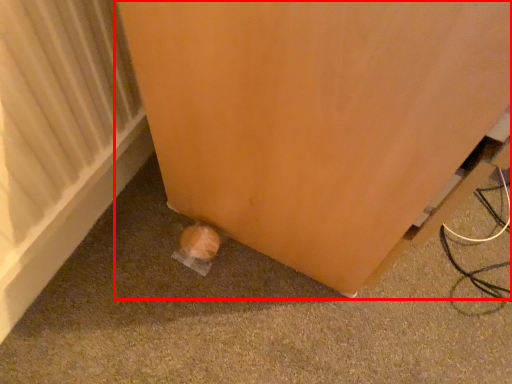
Question: From the image's perspective, what is the correct spatial positioning of furniture (annotated by the red box) in reference to radiator?

Choices:
 (A) below
 (B) above

Answer: (B)